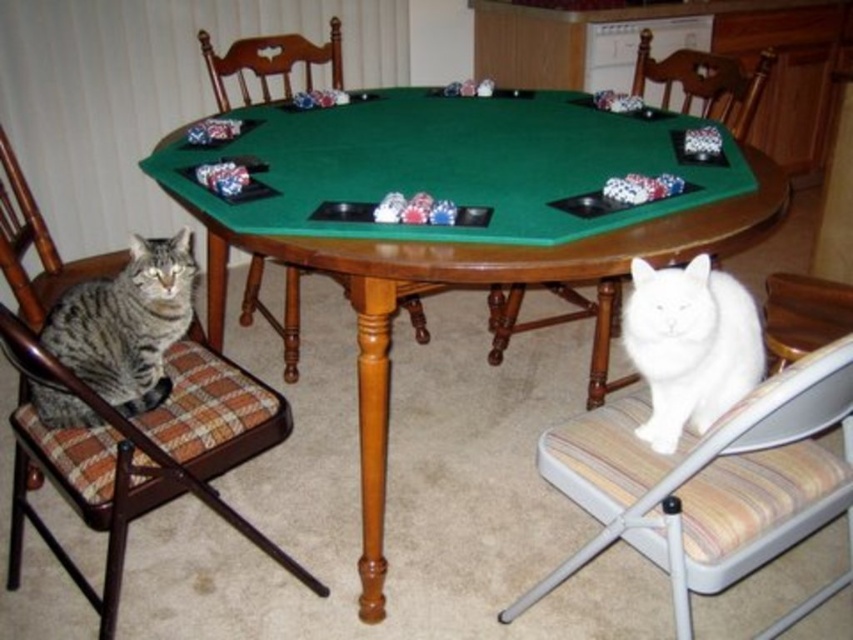
Consider the image. Can you confirm if green felt table at center is wider than white fabric chair at lower right?

Indeed, green felt table at center has a greater width compared to white fabric chair at lower right.

Who is more distant from viewer, (x=260, y=246) or (x=602, y=332)?

The point (x=602, y=332) is more distant.

You are a GUI agent. You are given a task and a screenshot of the screen. Output one action in this format:
    pyautogui.click(x=<x>, y=<y>)
    Task: Click on the green felt table at center
    The image size is (853, 640).
    Given the screenshot: What is the action you would take?
    pyautogui.click(x=457, y=228)

How distant is striped fabric chair at lower right from brown plaid cushioned chair at left?

striped fabric chair at lower right is 82.45 centimeters away from brown plaid cushioned chair at left.

Which is behind, point (618, 435) or point (186, 356)?

Positioned behind is point (186, 356).

Is point (805, 412) more distant than point (50, 288)?

No, (805, 412) is closer to viewer.

Locate an element on the screen. The height and width of the screenshot is (640, 853). striped fabric chair at lower right is located at coordinates (711, 481).

Who is positioned more to the left, striped fabric chair at lower right or wooden chair at center?

From the viewer's perspective, wooden chair at center appears more on the left side.

Identify the location of striped fabric chair at lower right. The width and height of the screenshot is (853, 640). (711, 481).

The height and width of the screenshot is (640, 853). What are the coordinates of `striped fabric chair at lower right` in the screenshot? It's located at (711, 481).